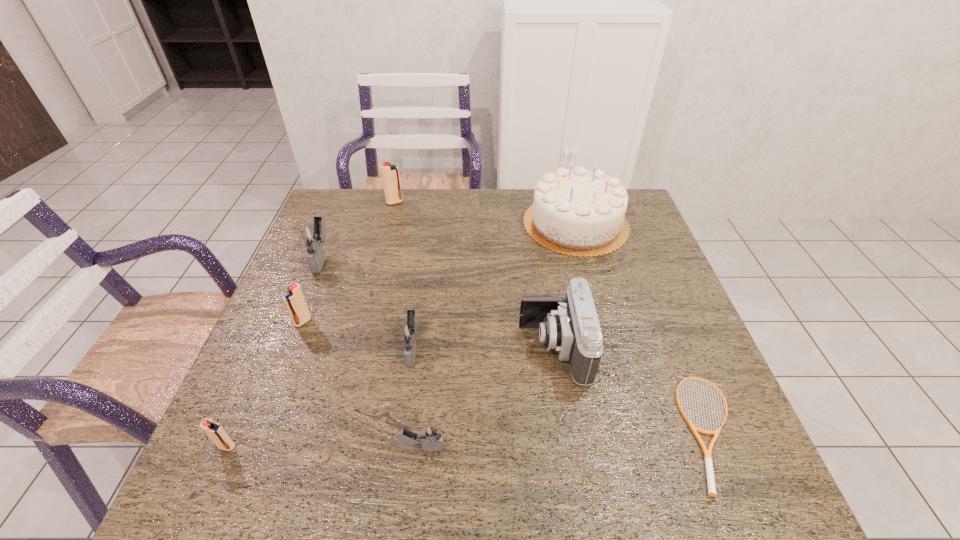
Image resolution: width=960 pixels, height=540 pixels. Identify the location of the leftmost red igniter. (215, 431).

Locate an element on the screen. the nearest red igniter is located at coordinates [x=215, y=431].

The width and height of the screenshot is (960, 540). Identify the location of the nearest gray igniter. (431, 438).

The width and height of the screenshot is (960, 540). I want to click on tennis racket, so click(707, 453).

I want to click on the shortest object, so click(x=707, y=453).

What are the coordinates of `free point located 0.120m on the left of the birthday cake` in the screenshot? It's located at (485, 224).

The image size is (960, 540). In order to click on free spot located on the left of the farthest igniter in this screenshot , I will do `click(333, 202)`.

This screenshot has height=540, width=960. Find the location of `free space located 0.270m on the right of the leftmost gray igniter`. free space located 0.270m on the right of the leftmost gray igniter is located at coordinates (430, 258).

Locate an element on the screen. vacant region located at the front of the camera with an open lens cover is located at coordinates (371, 348).

At what (x,y) coordinates should I click in order to perform the action: click on free space located at the front of the camera with an open lens cover. Please return your answer as a coordinate pair (x, y). Looking at the image, I should click on (473, 348).